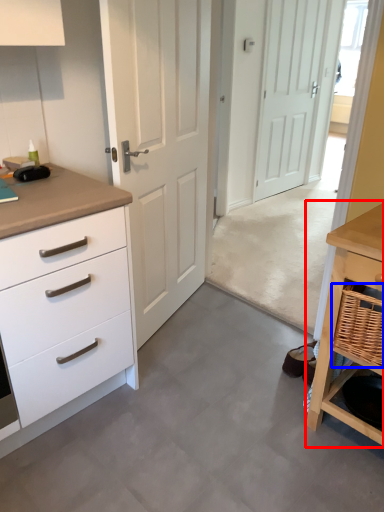
Question: Which of the following is the farthest to the observer, table (highlighted by a red box) or basket (highlighted by a blue box)?

Choices:
 (A) table
 (B) basket

Answer: (B)